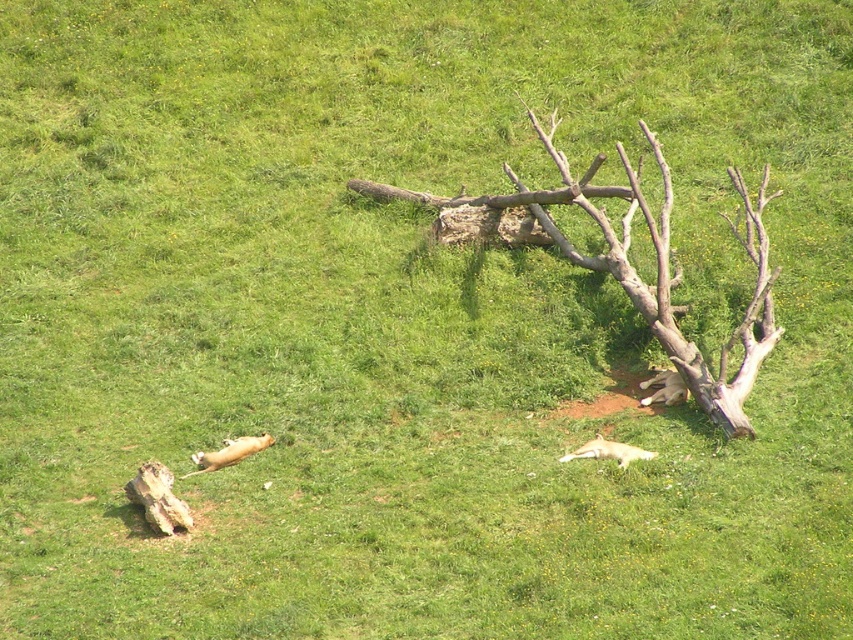
You are a photographer trying to capture the golden fur fox at lower left without the brown rough wood at center blocking the view. Can you move to the left side of the scene to take the photo?

The brown rough wood at center is positioned over golden fur fox at lower left, so moving to the left side of the scene might still have the brown rough wood at center blocking the view of the golden fur fox at lower left.